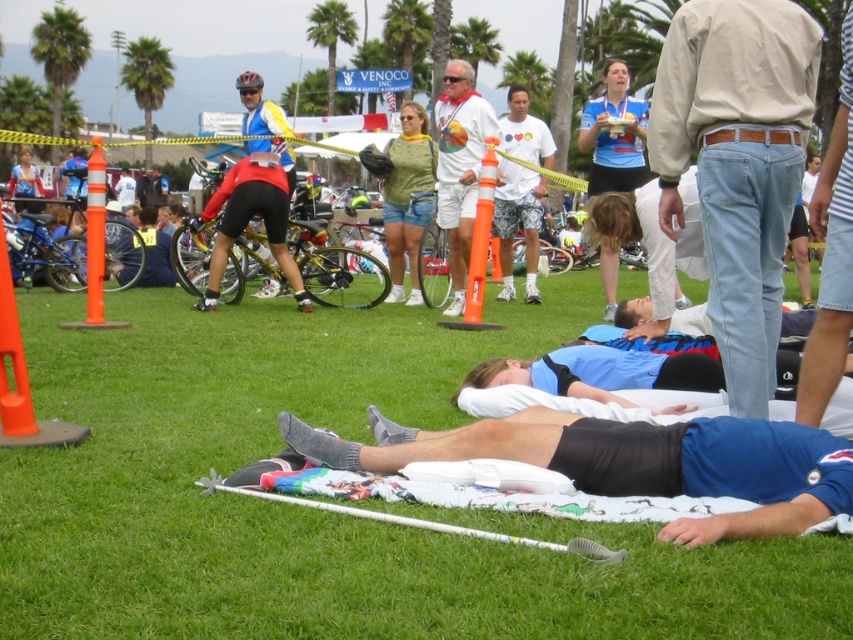
Looking at this image, is green grass at lower center thinner than green jersey at center?

No, green grass at lower center is not thinner than green jersey at center.

Does point (682, 589) come behind point (430, 180)?

No, (682, 589) is closer to viewer.

Find the location of a particular element. Image resolution: width=853 pixels, height=640 pixels. green grass at lower center is located at coordinates (321, 513).

Does green grass at lower center lie behind blue cotton shirt at lower right?

No, green grass at lower center is in front of blue cotton shirt at lower right.

Based on the photo, is green grass at lower center shorter than blue cotton shirt at lower right?

Incorrect, green grass at lower center's height does not fall short of blue cotton shirt at lower right's.

Is point (294, 560) farther from viewer compared to point (474, 438)?

No, it is in front of (474, 438).

Locate an element on the screen. The height and width of the screenshot is (640, 853). green grass at lower center is located at coordinates (321, 513).

Who is more forward, [467,131] or [427,214]?

Point [467,131] is more forward.

Can you confirm if white matte shirt at center is bigger than green jersey at center?

Yes, white matte shirt at center is bigger than green jersey at center.

The width and height of the screenshot is (853, 640). Identify the location of white matte shirt at center. (459, 166).